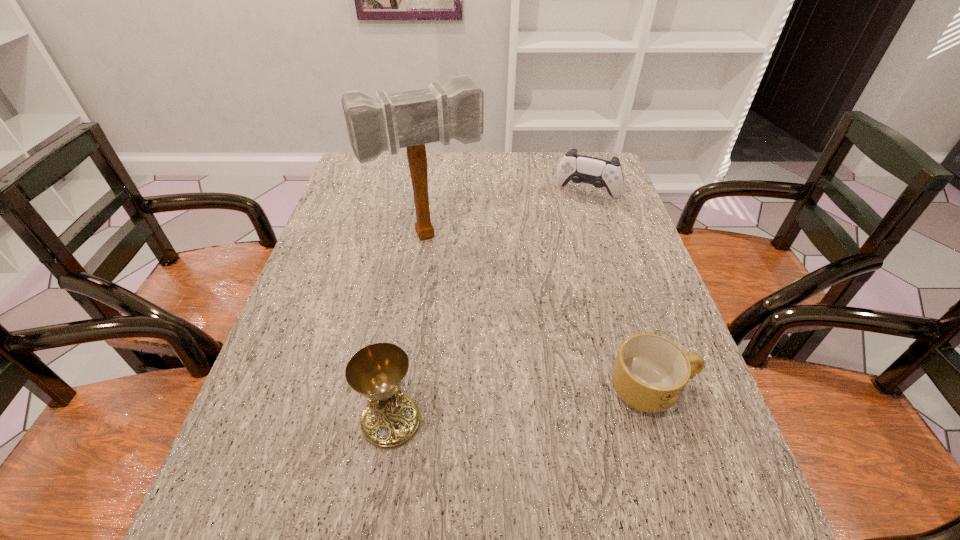
This screenshot has height=540, width=960. I want to click on unoccupied area between the control and the chalice, so click(490, 307).

Find the location of a particular element. The height and width of the screenshot is (540, 960). blank region between the control and the chalice is located at coordinates (490, 307).

Select which object appears as the second closest to the chalice. Please provide its 2D coordinates. Your answer should be formatted as a tuple, i.e. [(x, y)], where the tuple contains the x and y coordinates of a point satisfying the conditions above.

[(411, 119)]

This screenshot has width=960, height=540. In order to click on object that is the third closest one to the mug in this screenshot , I will do `click(600, 173)`.

Find the location of a particular element. The height and width of the screenshot is (540, 960). free space that satisfies the following two spatial constraints: 1. on the front side of the tallest object; 2. on the side with the handle of the shortest object is located at coordinates (407, 390).

Find the location of `free location that satisfies the following two spatial constraints: 1. on the back side of the third shortest object; 2. on the side with the handle of the mug`. free location that satisfies the following two spatial constraints: 1. on the back side of the third shortest object; 2. on the side with the handle of the mug is located at coordinates (396, 390).

I want to click on vacant point that satisfies the following two spatial constraints: 1. on the back side of the shortest object; 2. on the side with the handle of the chalice, so click(396, 390).